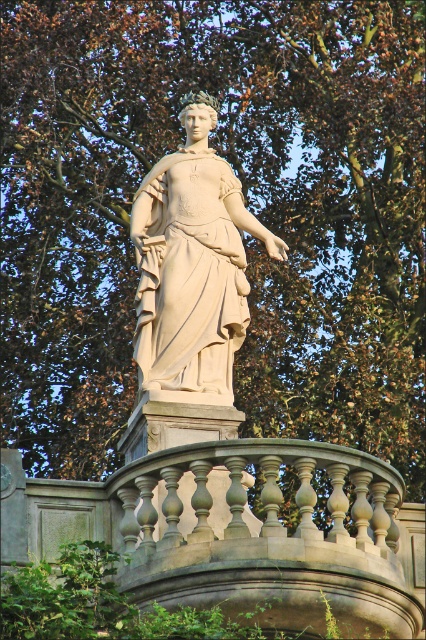
Which of these two, gray stone balustrade at center or beige stone statue at center, stands taller?

With more height is beige stone statue at center.

Is point (192, 536) closer to camera compared to point (187, 266)?

Yes, point (192, 536) is closer to viewer.

In order to click on gray stone balustrade at center in this screenshot , I will do `click(233, 531)`.